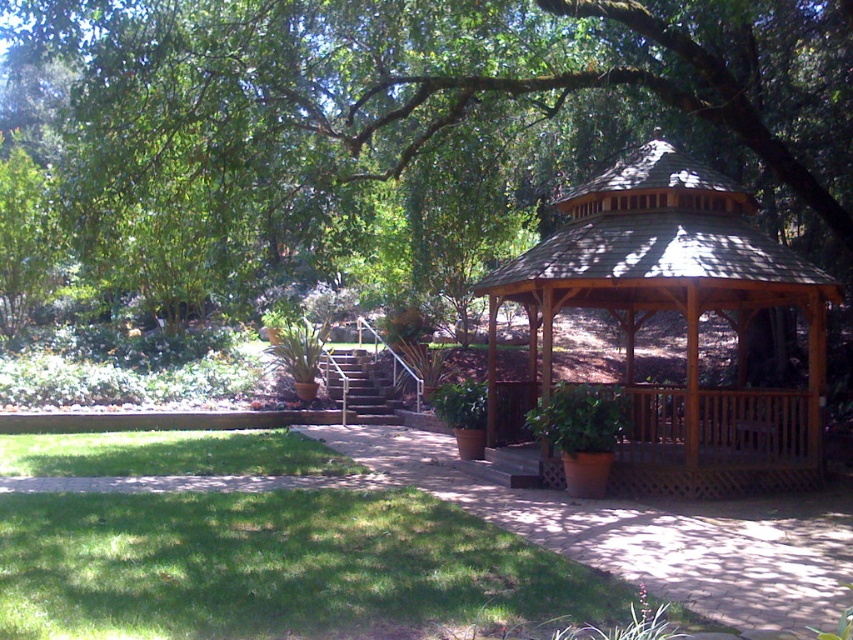
You are planning to install a new garden sprinkler system. The sprinkler has a maximum range of 7 meters. If you position the sprinkler at the green grass at lower left, will it be able to water the green leafy tree at center?

The green leafy tree at center is 7.30 meters away from the green grass at lower left. Since the sprinkler has a maximum range of 7 meters, it cannot reach the tree from that position.

You are standing at the entrance of the garden and see the green leafy tree at center and the green grass at lower left. Which object is located to the left of the other?

The green leafy tree at center is positioned on the left side of green grass at lower left.

You are planning to install a small solar panel on the roof of the wooden gazebo at center. However, you need to ensure that the green leafy tree at center won not block sunlight. Based on the scene description, will the tree cast a shadow over the gazebo?

The green leafy tree at center is located above the wooden gazebo at center, so it will cast a shadow over the gazebo, potentially blocking sunlight.